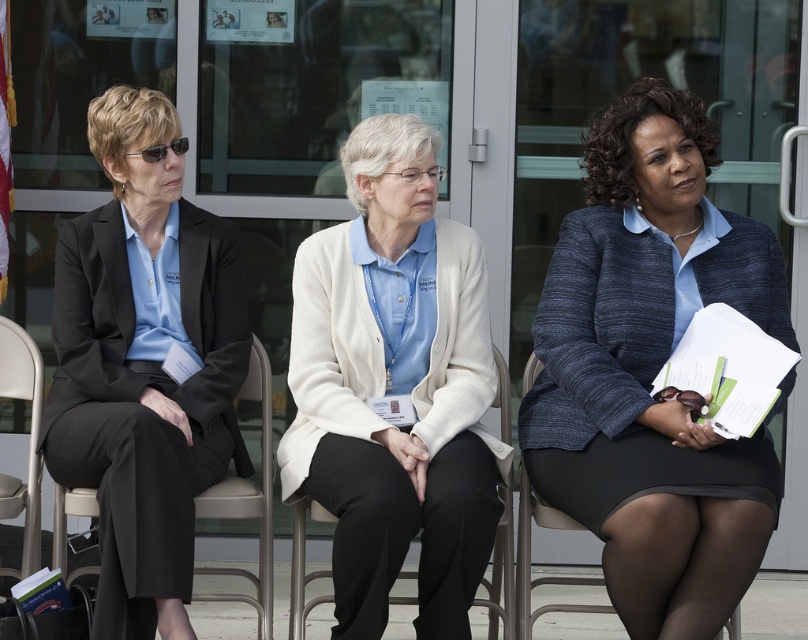
Who is lower down, black matte suit at left or metallic silver chair at left?

metallic silver chair at left

Does point (57, 413) come farther from viewer compared to point (23, 573)?

No, (57, 413) is closer to viewer.

This screenshot has height=640, width=808. In order to click on black matte suit at left in this screenshot , I will do `click(91, 316)`.

Does blue textured blazer at center appear over metallic silver chair at left?

Indeed, blue textured blazer at center is positioned over metallic silver chair at left.

Is blue textured blazer at center further to camera compared to metallic silver chair at left?

No, blue textured blazer at center is in front of metallic silver chair at left.

Does point (709, 240) come behind point (15, 493)?

That is False.

In order to click on blue textured blazer at center in this screenshot , I will do `click(651, 369)`.

Between point (44, 408) and point (567, 528), which one is positioned behind?

Point (44, 408)

Does black matte suit at left have a smaller size compared to black fabric chair at center?

No.

Locate an element on the screen. This screenshot has width=808, height=640. black matte suit at left is located at coordinates (91, 316).